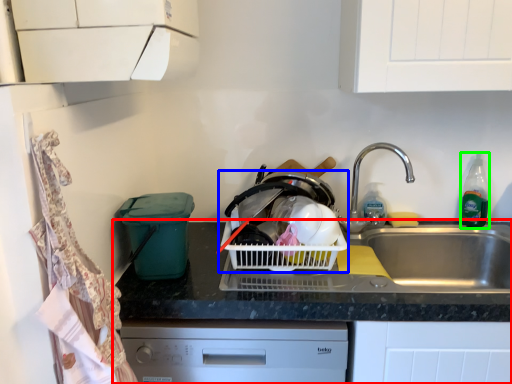
Question: Which is farther away from countertop (highlighted by a red box)? basket container (highlighted by a blue box) or bottle (highlighted by a green box)?

Choices:
 (A) basket container
 (B) bottle

Answer: (B)